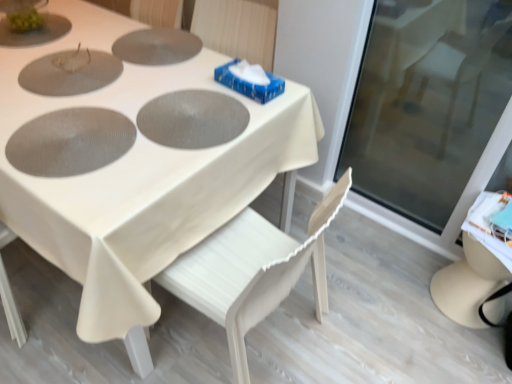
Find the location of `vacant area that lies in front of gray matte pizza pan at center, which is the second pizza pan in back-to-front order`. vacant area that lies in front of gray matte pizza pan at center, which is the second pizza pan in back-to-front order is located at coordinates pos(145,169).